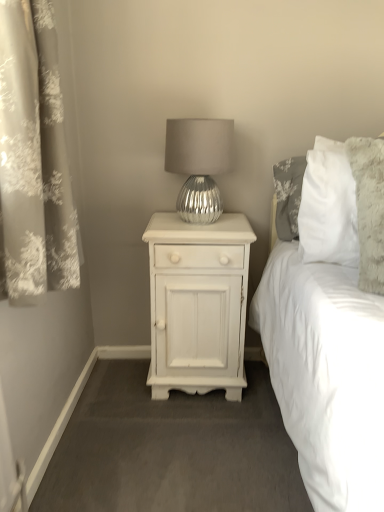
The width and height of the screenshot is (384, 512). I want to click on vacant space positioned to the left of white painted wood nightstand at center, so click(114, 389).